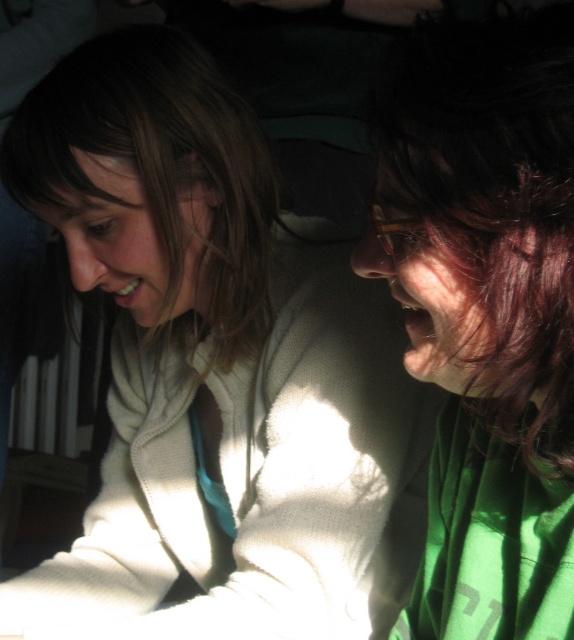
Can you confirm if white fuzzy sweater at center is wider than shiny brown hair at right?

Indeed, white fuzzy sweater at center has a greater width compared to shiny brown hair at right.

Who is shorter, white fuzzy sweater at center or shiny brown hair at right?

shiny brown hair at right

I want to click on white fuzzy sweater at center, so click(x=210, y=364).